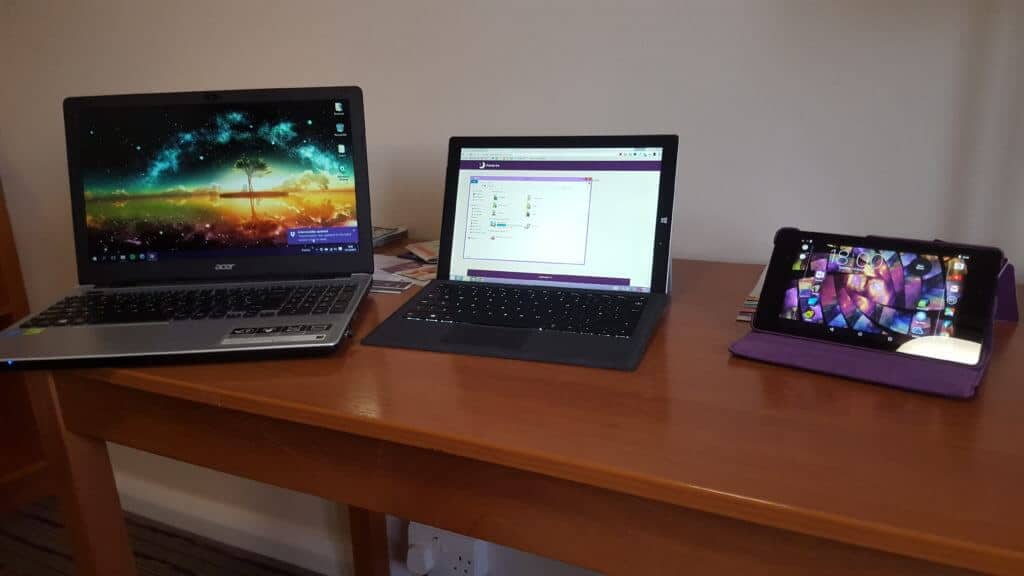
The width and height of the screenshot is (1024, 576). I want to click on baseboard trim, so click(x=237, y=530).